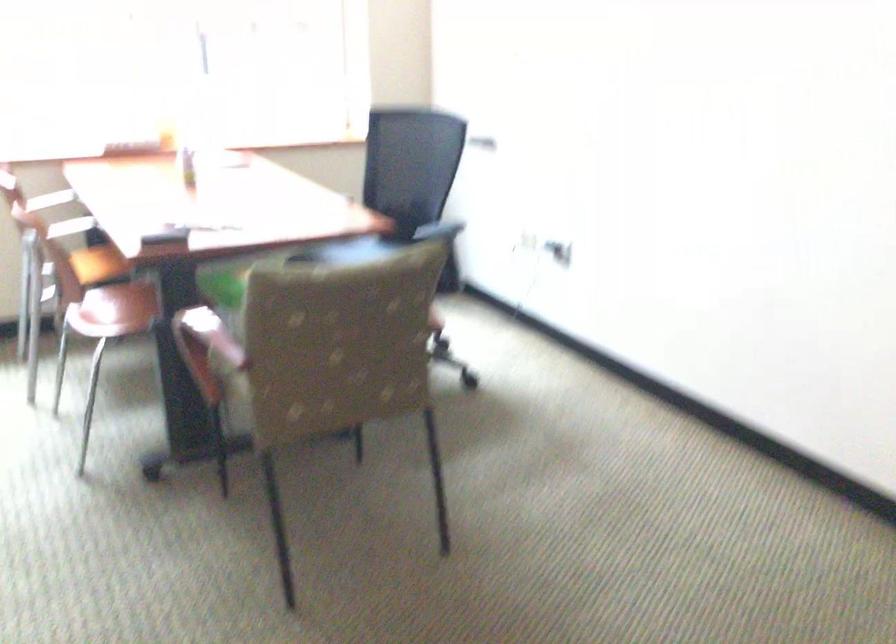
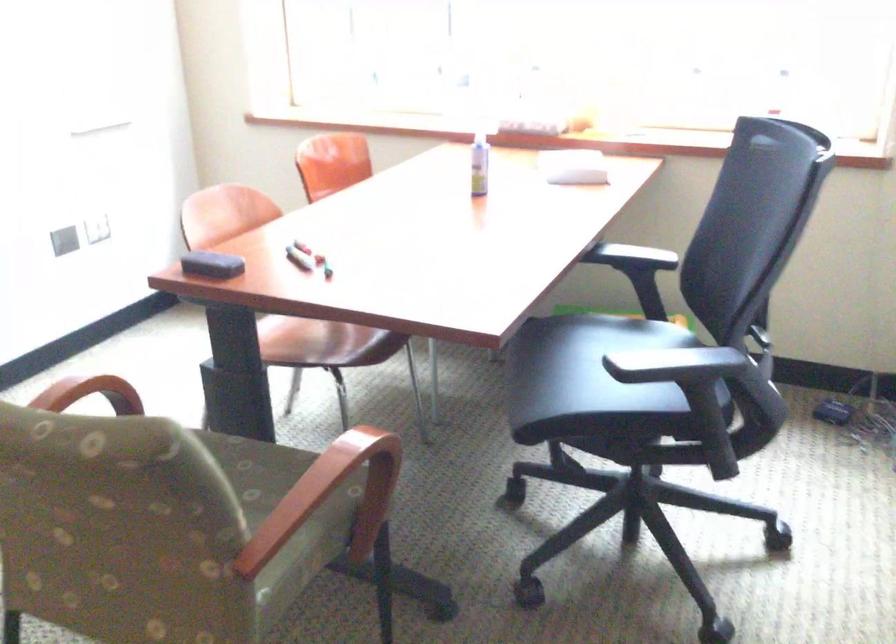
Where in the second image is the point corresponding to point (113, 308) from the first image?

(295, 336)